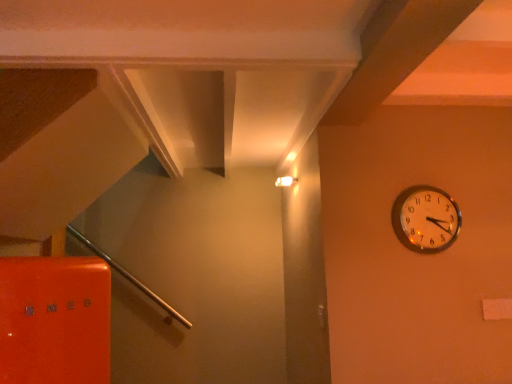
Measure the distance between metallic silver clock at right and camera.

6.04 feet.

What do you see at coordinates (426, 219) in the screenshot? This screenshot has width=512, height=384. I see `metallic silver clock at right` at bounding box center [426, 219].

Locate an element on the screen. The image size is (512, 384). metallic silver clock at right is located at coordinates (426, 219).

Measure the distance between point [433,236] and camera.

Point [433,236] is 6.06 feet away from camera.

Where is `metallic silver clock at right`? The image size is (512, 384). metallic silver clock at right is located at coordinates (426, 219).